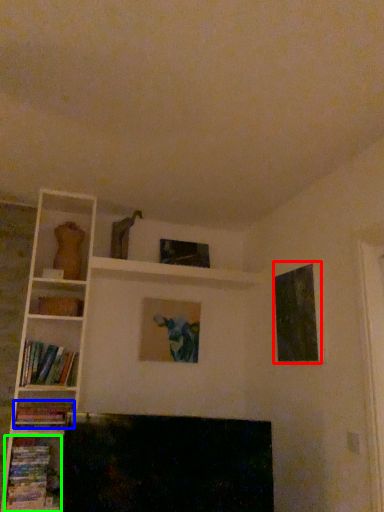
Question: Estimate the real-world distances between objects in this image. Which object is closer to picture frame (highlighted by a red box), book (highlighted by a blue box) or book (highlighted by a green box)?

Choices:
 (A) book
 (B) book

Answer: (A)